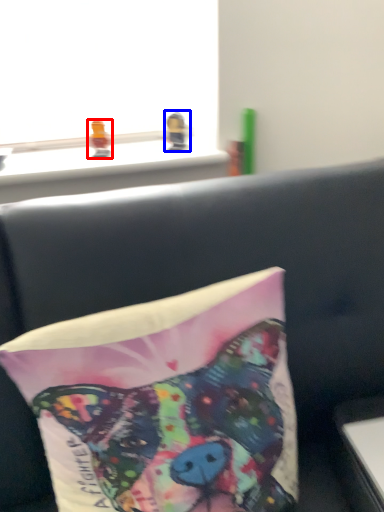
Question: Among these objects, which one is farthest to the camera, toy (highlighted by a red box) or toy (highlighted by a blue box)?

Choices:
 (A) toy
 (B) toy

Answer: (B)